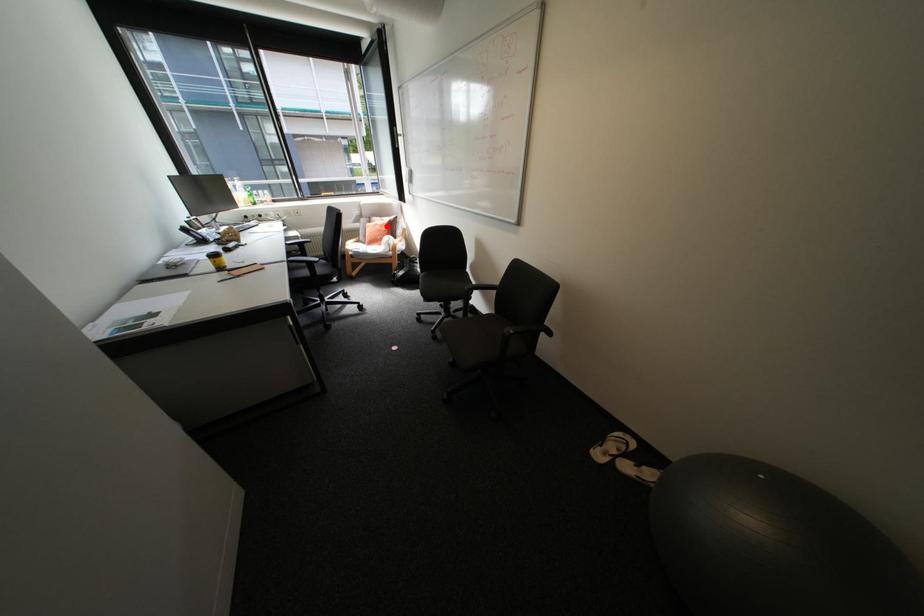
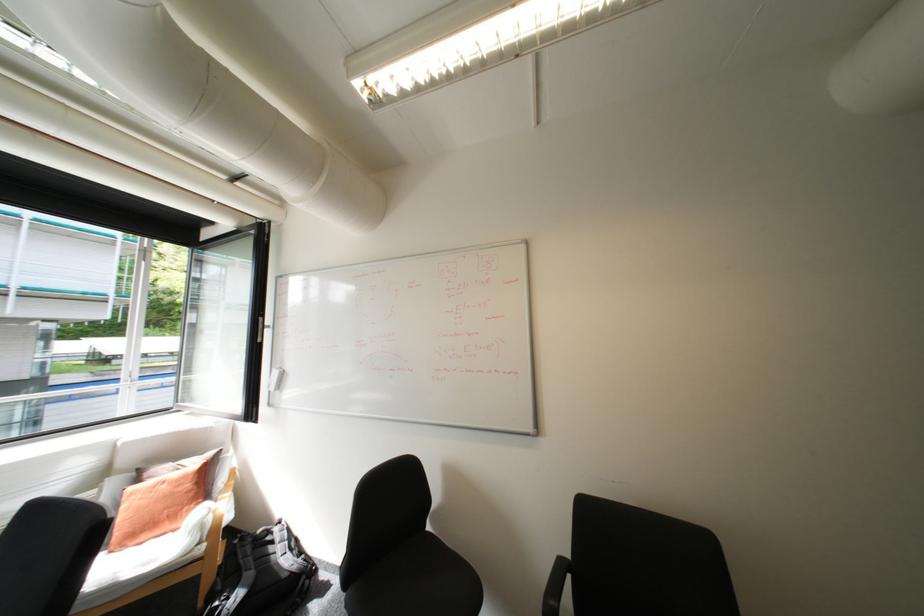
Find the pixel in the second image that matches the highlighted location in the first image.

(175, 485)